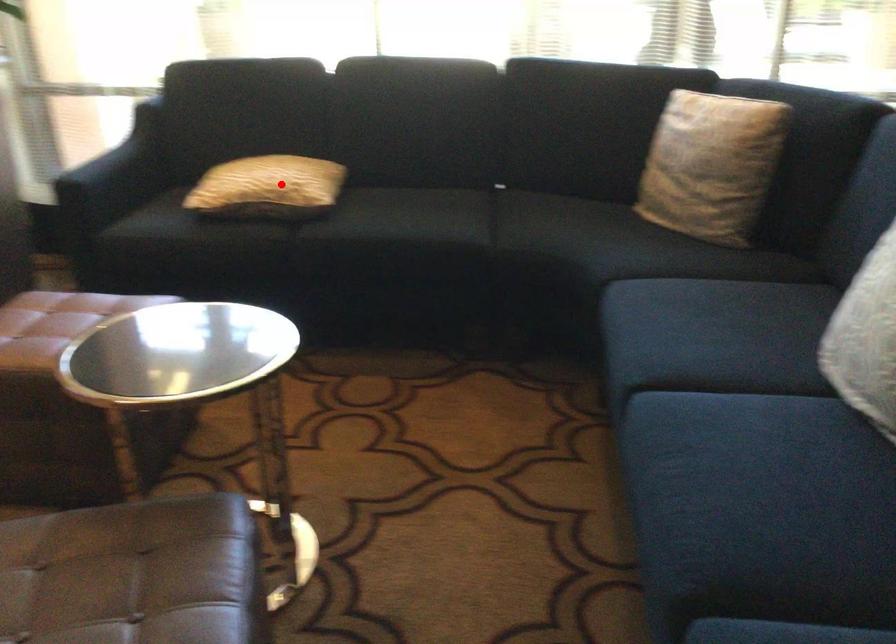
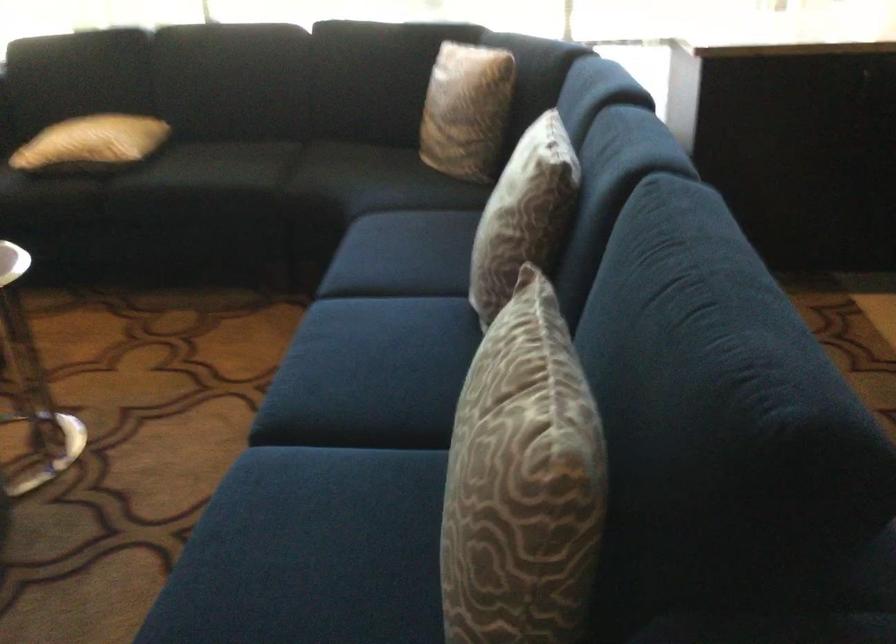
Question: I am providing you with two images of the same scene from different viewpoints. A red point is shown in image1. For the corresponding object point in image2, is it positioned nearer or farther from the camera?

Choices:
 (A) Nearer
 (B) Farther

Answer: (B)